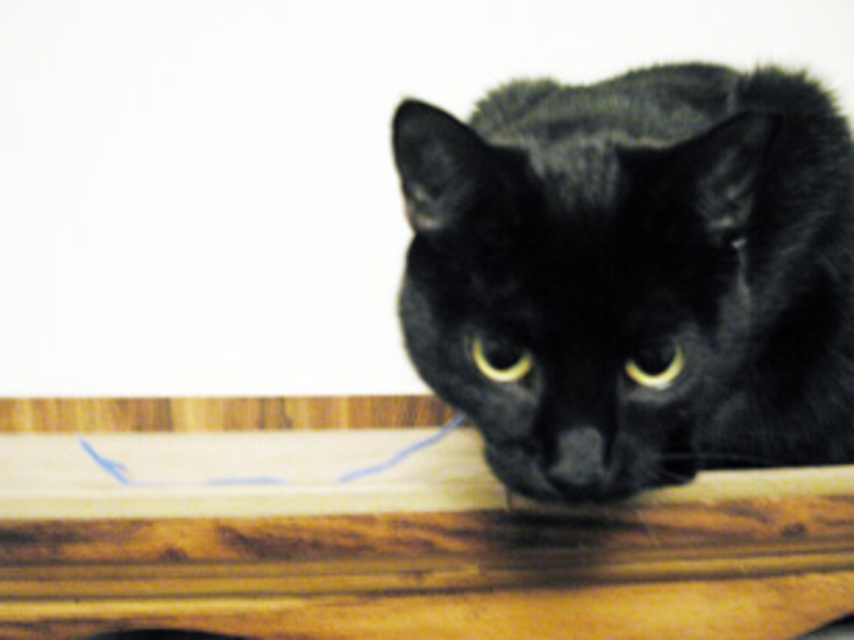
Does black fur cat at center appear on the right side of wooden table at center?

Correct, you'll find black fur cat at center to the right of wooden table at center.

Is black fur cat at center bigger than wooden table at center?

No.

Identify the location of black fur cat at center. This screenshot has width=854, height=640. (635, 275).